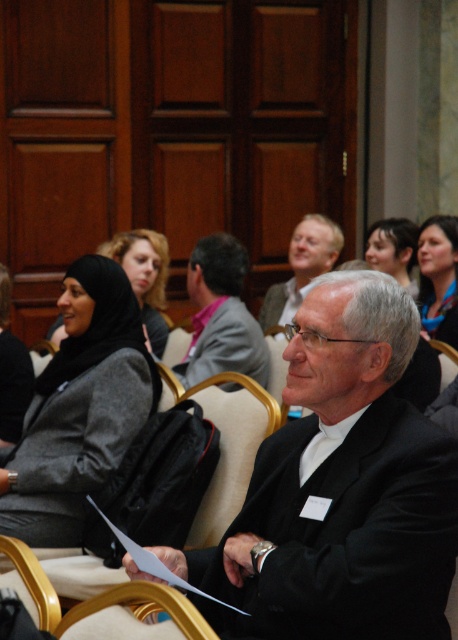
Please describe the position of the gray fabric jacket at center in the image using coordinates.

The gray fabric jacket at center is located at coordinates point [222,316].

In the scene, there are two individuals dressed in black clothing. The first is wearing a black matte suit at center, and the second has a matte black hijab at upper left. From the perspective of someone sitting at the front of the room, which of these two items is positioned to the right?

The black matte suit at center is to the right of the matte black hijab at upper left, so from the front of the room perspective, the black matte suit at center is positioned to the right.